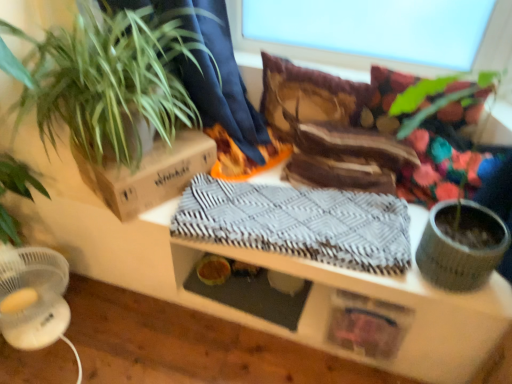
Where is `free spot above textured wood table at center (from a real-world perspective)`? free spot above textured wood table at center (from a real-world perspective) is located at coordinates (305, 201).